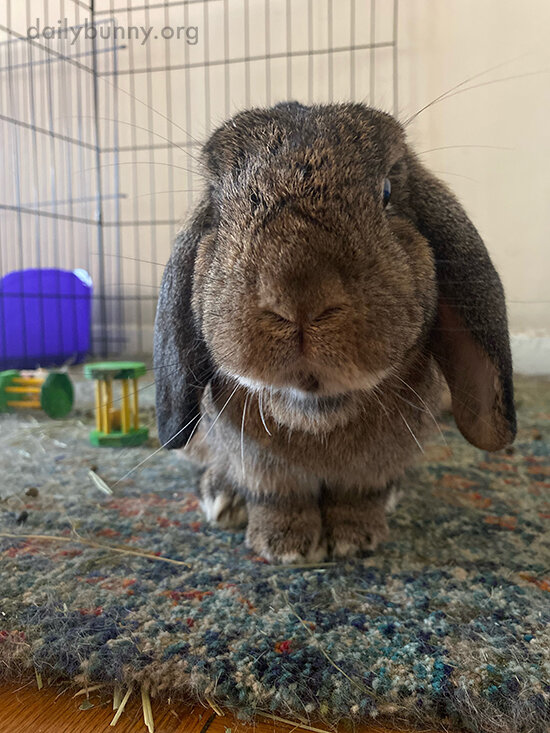
Image resolution: width=550 pixels, height=733 pixels. I want to click on empty space on wall, so click(x=532, y=136).